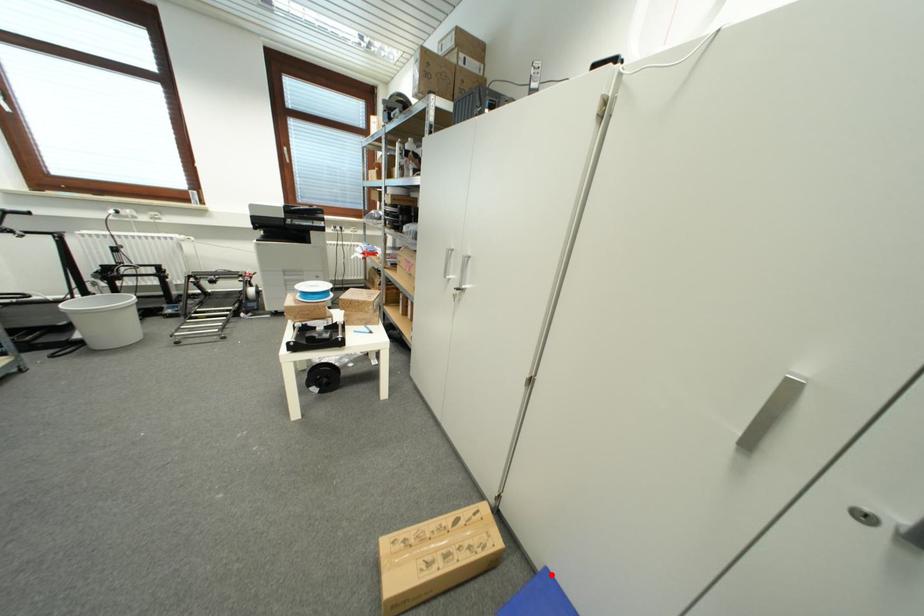
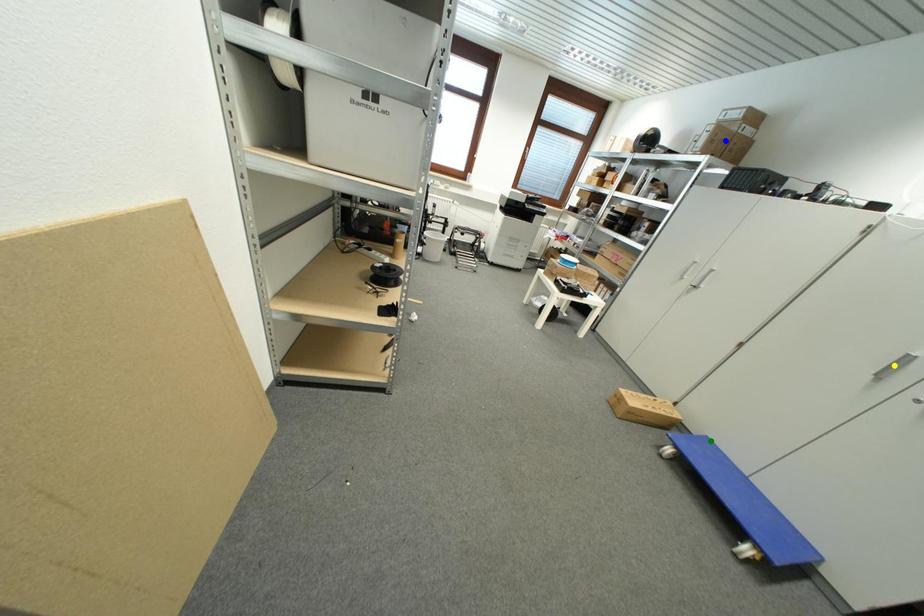
Question: I am providing you with two images of the same scene from different viewpoints. A red point is marked on the first image. You are given multiple points on the second image. Which point in image 2 is actually the same real-world point as the red point in image 1?

Choices:
 (A) blue point
 (B) green point
 (C) yellow point

Answer: (B)